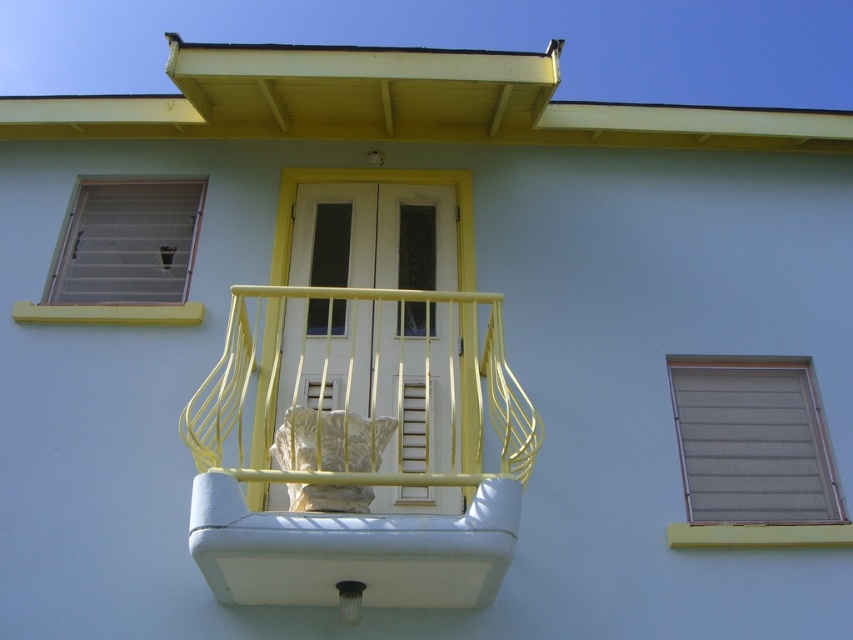
Is point (263, 486) more distant than point (148, 292)?

No, (263, 486) is closer to viewer.

Where is `metallic yellow balcony at center`? Image resolution: width=853 pixels, height=640 pixels. metallic yellow balcony at center is located at coordinates (357, 451).

Does metallic yellow balcony at center appear over yellow matte/finish window sill at upper center?

Incorrect, metallic yellow balcony at center is not positioned above yellow matte/finish window sill at upper center.

Does metallic yellow balcony at center lie behind yellow matte/finish window sill at upper center?

That is False.

Which is behind, point (383, 310) or point (55, 317)?

Point (383, 310)

Identify the location of metallic yellow balcony at center. (357, 451).

Who is positioned more to the left, matte gray window at right or yellow painted wood at lower right?

A: From the viewer's perspective, yellow painted wood at lower right appears more on the left side.

Does point (769, 435) come in front of point (814, 538)?

No, (769, 435) is further to viewer.

The width and height of the screenshot is (853, 640). Identify the location of matte gray window at right. (753, 442).